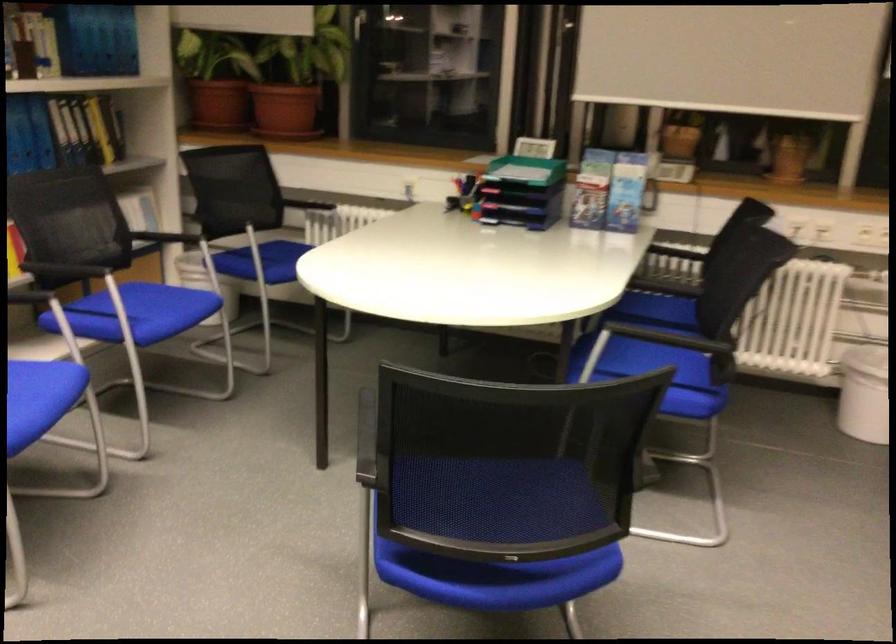
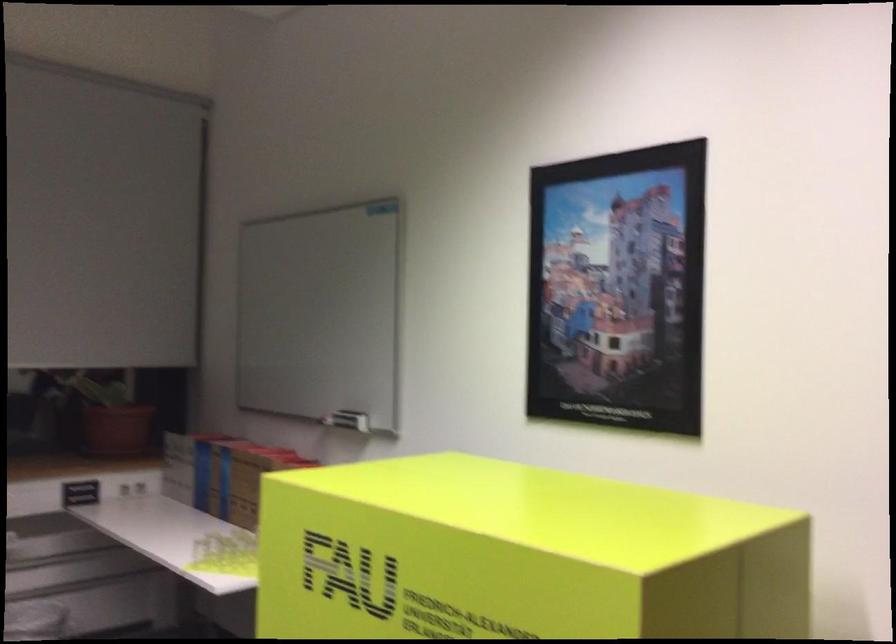
Question: The camera is either moving clockwise (left) or counter-clockwise (right) around the object. The first image is from the beginning of the video and the second image is from the end. Is the camera moving left or right when shooting the video?

Choices:
 (A) Left
 (B) Right

Answer: (A)